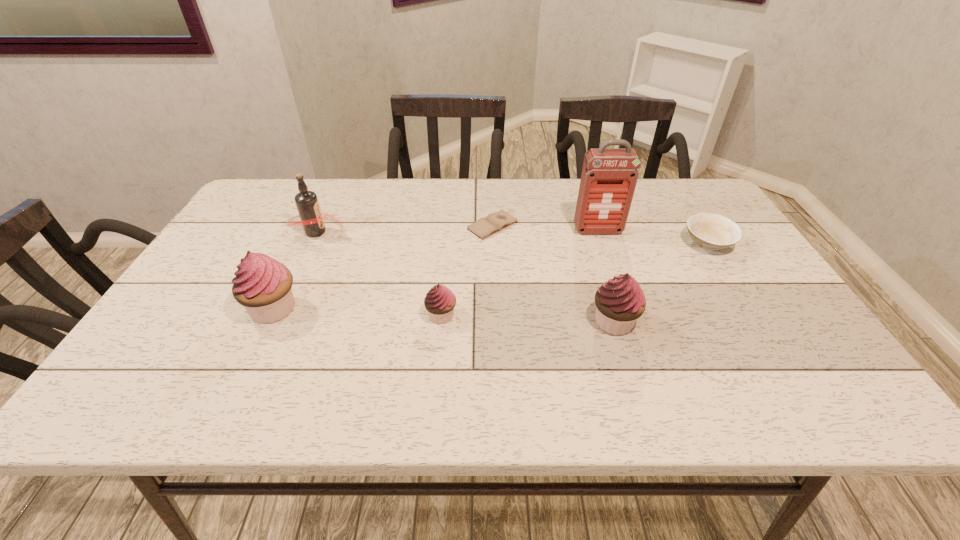
The width and height of the screenshot is (960, 540). In order to click on empty space between the second cupcake from right to left and the leftmost cupcake in this screenshot , I will do `click(357, 312)`.

The width and height of the screenshot is (960, 540). I want to click on vacant space in between the rightmost object and the shortest cupcake, so click(574, 280).

The height and width of the screenshot is (540, 960). I want to click on free space between the first-aid kit and the leftmost cupcake, so click(436, 269).

Image resolution: width=960 pixels, height=540 pixels. What are the coordinates of `free space between the first-aid kit and the diary` in the screenshot? It's located at (545, 228).

This screenshot has width=960, height=540. I want to click on empty location between the leftmost cupcake and the shortest cupcake, so click(x=357, y=312).

Find the location of a particular element. free area in between the fifth object from right to left and the second shortest object is located at coordinates (574, 280).

Identify the location of free space between the first-aid kit and the leftmost cupcake. pos(436,269).

Select which object appears as the fourth closest to the fourth shortest object. Please provide its 2D coordinates. Your answer should be formatted as a tuple, i.e. [(x, y)], where the tuple contains the x and y coordinates of a point satisfying the conditions above.

[(440, 301)]

Identify which object is the sixth closest to the tallest object. Please provide its 2D coordinates. Your answer should be formatted as a tuple, i.e. [(x, y)], where the tuple contains the x and y coordinates of a point satisfying the conditions above.

[(262, 285)]

The height and width of the screenshot is (540, 960). Find the location of `the third closest cupcake to the fourth object from left to right`. the third closest cupcake to the fourth object from left to right is located at coordinates (262, 285).